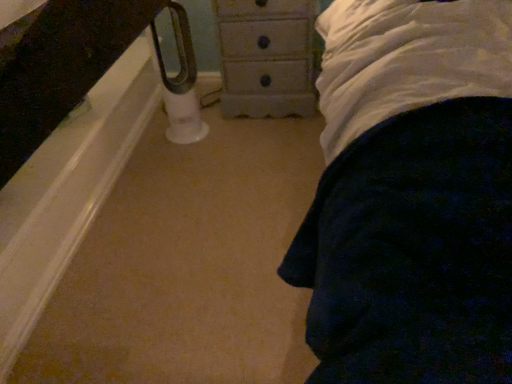
Question: Is white plastic towel bar at lower left positioned beyond the bounds of white painted wood chest of drawers at center?

Choices:
 (A) yes
 (B) no

Answer: (A)

Question: Is white plastic towel bar at lower left facing away from white painted wood chest of drawers at center?

Choices:
 (A) no
 (B) yes

Answer: (A)

Question: Does white plastic towel bar at lower left appear on the right side of white painted wood chest of drawers at center?

Choices:
 (A) yes
 (B) no

Answer: (B)

Question: Can you confirm if white plastic towel bar at lower left is bigger than white painted wood chest of drawers at center?

Choices:
 (A) yes
 (B) no

Answer: (B)

Question: From a real-world perspective, does white plastic towel bar at lower left sit lower than white painted wood chest of drawers at center?

Choices:
 (A) yes
 (B) no

Answer: (B)

Question: Is the position of white plastic towel bar at lower left more distant than that of white painted wood chest of drawers at center?

Choices:
 (A) yes
 (B) no

Answer: (B)

Question: Considering the relative sizes of white painted wood chest of drawers at center and white plastic towel bar at lower left in the image provided, is white painted wood chest of drawers at center wider than white plastic towel bar at lower left?

Choices:
 (A) yes
 (B) no

Answer: (A)

Question: Is white plastic towel bar at lower left at the back of white painted wood chest of drawers at center?

Choices:
 (A) no
 (B) yes

Answer: (A)

Question: From the image's perspective, would you say white painted wood chest of drawers at center is shown under white plastic towel bar at lower left?

Choices:
 (A) yes
 (B) no

Answer: (B)

Question: From a real-world perspective, is white painted wood chest of drawers at center positioned under white plastic towel bar at lower left based on gravity?

Choices:
 (A) yes
 (B) no

Answer: (A)

Question: From the image's perspective, is white painted wood chest of drawers at center on top of white plastic towel bar at lower left?

Choices:
 (A) yes
 (B) no

Answer: (A)

Question: Is white painted wood chest of drawers at center bigger than white plastic towel bar at lower left?

Choices:
 (A) yes
 (B) no

Answer: (A)

Question: From a real-world perspective, is white painted wood chest of drawers at center positioned above or below white plastic towel bar at lower left?

Choices:
 (A) above
 (B) below

Answer: (B)